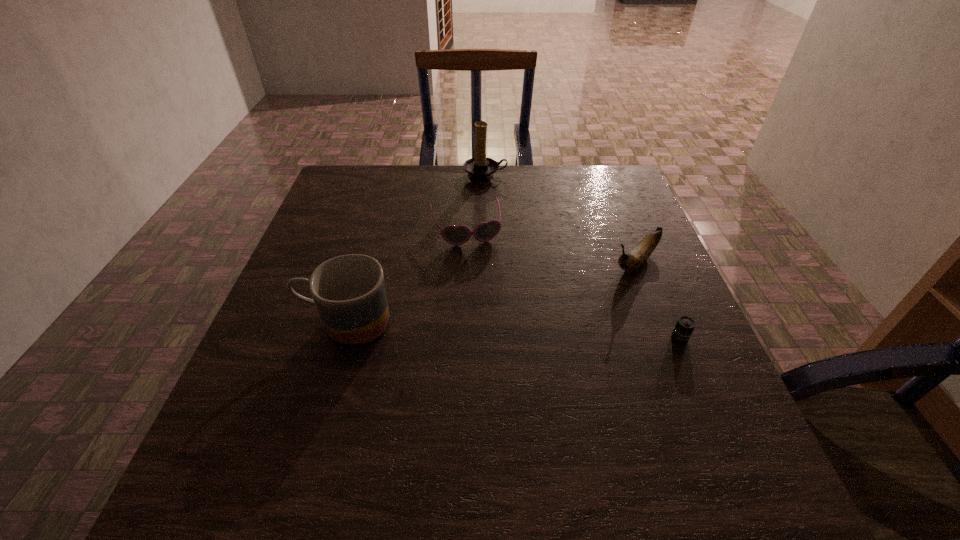
Identify the location of vacant area located 0.290m on the front-facing side of the second shortest object. coord(498,336).

What are the coordinates of `vacant space located on the wick of the farthest object` in the screenshot? It's located at (493, 195).

Where is `vacant space located 0.100m on the wick of the farthest object`? vacant space located 0.100m on the wick of the farthest object is located at coordinates (496, 202).

This screenshot has height=540, width=960. Find the location of `blank space located 0.390m on the wick of the farthest object`. blank space located 0.390m on the wick of the farthest object is located at coordinates (521, 270).

Where is `vacant space located 0.060m at the stem of the banana`? This screenshot has width=960, height=540. vacant space located 0.060m at the stem of the banana is located at coordinates (605, 289).

At what (x,y) coordinates should I click in order to perform the action: click on free location located 0.290m at the stem of the banana. Please return your answer as a coordinate pair (x, y). The image size is (960, 540). Looking at the image, I should click on (541, 348).

The width and height of the screenshot is (960, 540). What are the coordinates of `vacant area situated at the stem of the banana` in the screenshot? It's located at (535, 353).

At what (x,y) coordinates should I click in order to perform the action: click on object present at the far edge. Please return your answer as a coordinate pair (x, y). This screenshot has width=960, height=540. Looking at the image, I should click on (480, 168).

Identify the location of object at the left edge. (349, 291).

The image size is (960, 540). What are the coordinates of `beer can positioned at the right edge` in the screenshot? It's located at (684, 327).